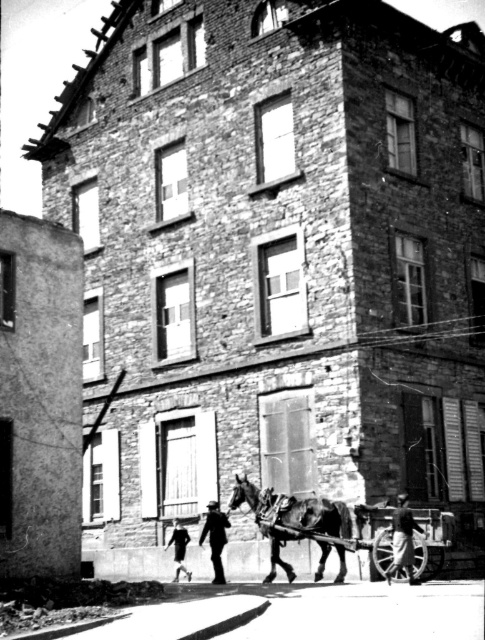
Between point (274, 493) and point (413, 570), which one is positioned behind?

The point (274, 493) is more distant.

Where is `dark brown leather horse at lower center`? The width and height of the screenshot is (485, 640). dark brown leather horse at lower center is located at coordinates (294, 524).

Consider the image. Who is lower down, dark blue uniform at center or dark gray fabric coat at lower center?

dark gray fabric coat at lower center is below.

Who is positioned more to the left, dark blue uniform at center or dark gray fabric coat at lower center?

dark gray fabric coat at lower center

Where is `dark blue uniform at center`? The height and width of the screenshot is (640, 485). dark blue uniform at center is located at coordinates (214, 538).

Locate an element on the screen. dark blue uniform at center is located at coordinates (214, 538).

Which of these two, dark gray fabric coat at lower right or dark blue uniform at center, stands taller?

Standing taller between the two is dark blue uniform at center.

Who is positioned more to the right, dark gray fabric coat at lower right or dark blue uniform at center?

From the viewer's perspective, dark gray fabric coat at lower right appears more on the right side.

Locate an element on the screen. This screenshot has width=485, height=640. dark gray fabric coat at lower right is located at coordinates (403, 540).